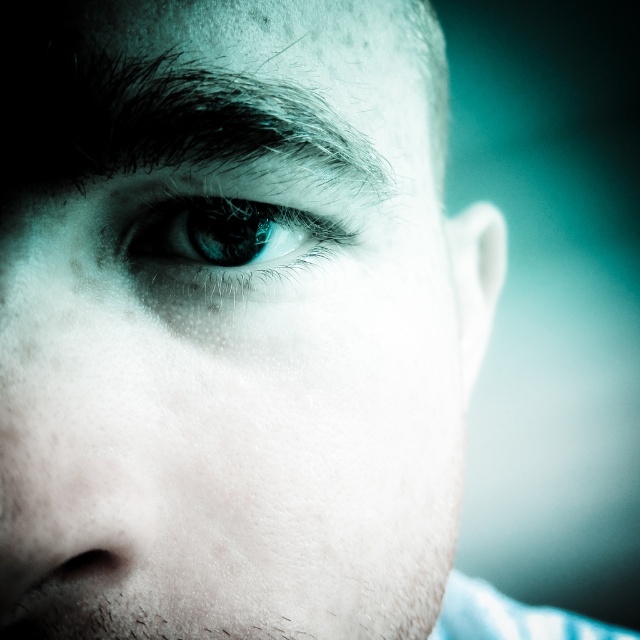
Question: Among these points, which one is nearest to the camera?

Choices:
 (A) (227, 243)
 (B) (189, 388)

Answer: (B)

Question: Can you confirm if smooth skin eye at center is positioned to the right of blue glossy eye at center?

Choices:
 (A) yes
 (B) no

Answer: (A)

Question: Can you confirm if smooth skin eye at center is positioned above blue glossy eye at center?

Choices:
 (A) no
 (B) yes

Answer: (A)

Question: Among these points, which one is farthest from the camera?

Choices:
 (A) (202, 292)
 (B) (221, 129)

Answer: (A)

Question: Can you confirm if smooth skin eye at center is bigger than blue glossy eye at center?

Choices:
 (A) no
 (B) yes

Answer: (B)

Question: Which point is farther to the camera?

Choices:
 (A) blue glossy eye at center
 (B) smooth skin eye at center

Answer: (A)